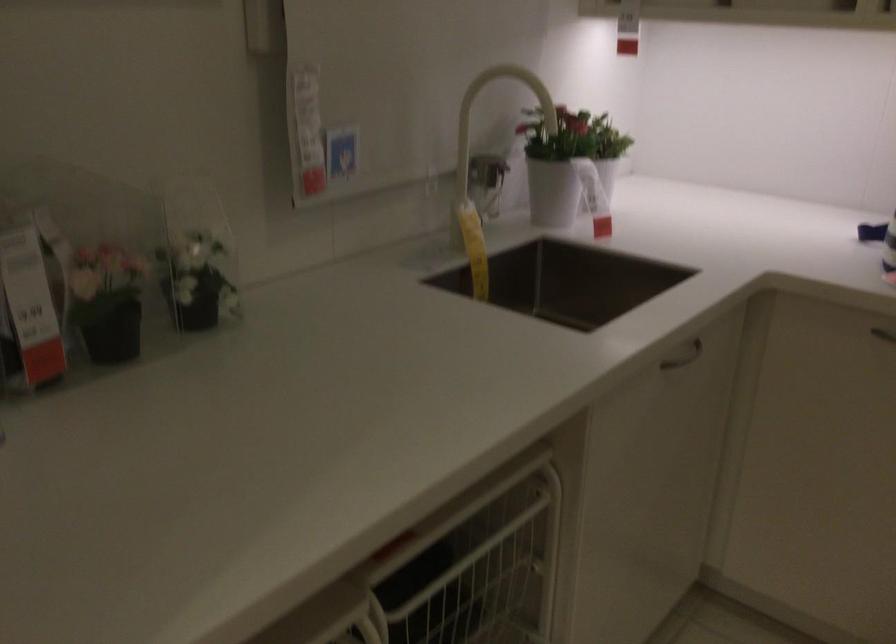
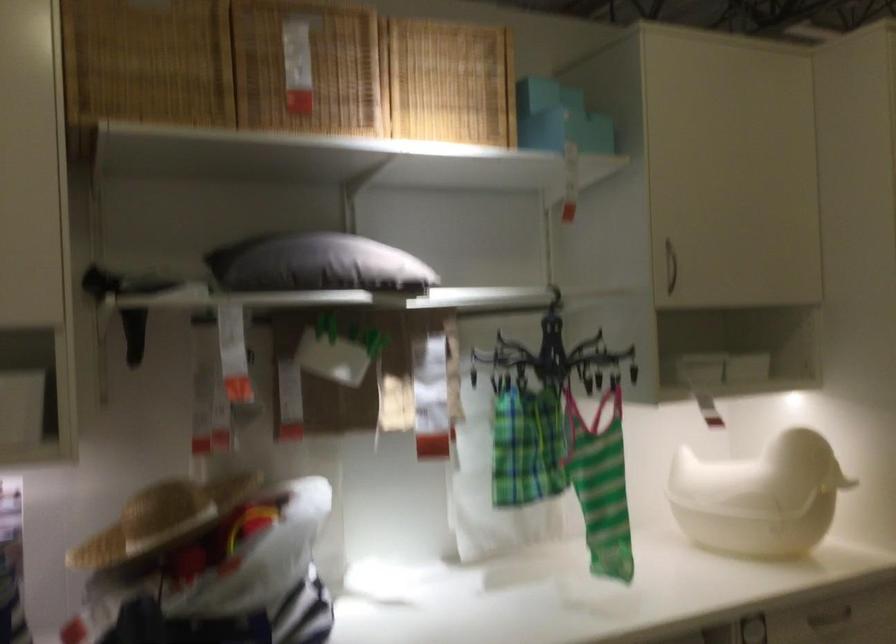
Question: The camera is either moving clockwise (left) or counter-clockwise (right) around the object. The first image is from the beginning of the video and the second image is from the end. Is the camera moving left or right when shooting the video?

Choices:
 (A) Left
 (B) Right

Answer: (A)